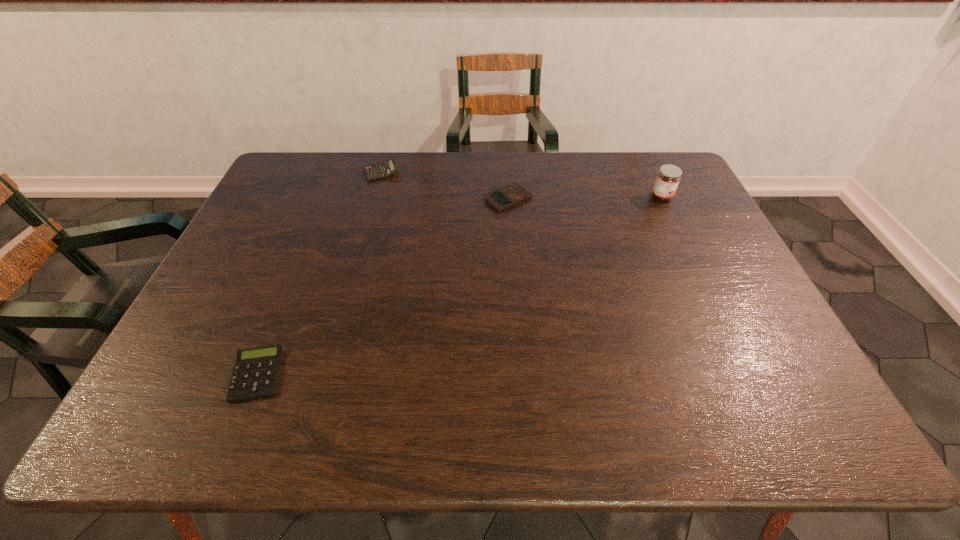
Identify the location of vacant space at the right edge of the desktop. This screenshot has width=960, height=540. (737, 294).

Where is `vacant space at the far left corner`? This screenshot has width=960, height=540. vacant space at the far left corner is located at coordinates (319, 180).

Locate an element on the screen. The image size is (960, 540). free space between the rightmost object and the leftmost object is located at coordinates click(x=460, y=286).

What are the coordinates of `blank region between the rightmost object and the second nearest calculator` in the screenshot? It's located at (586, 198).

I want to click on free space between the farthest object and the shortest calculator, so click(319, 273).

Locate an element on the screen. This screenshot has height=540, width=960. vacant area that lies between the rightmost object and the tallest calculator is located at coordinates (521, 185).

Where is `free space between the second shortest object and the second object from left to right`? free space between the second shortest object and the second object from left to right is located at coordinates (444, 185).

Locate an element on the screen. The image size is (960, 540). vacant space in between the tallest calculator and the leftmost calculator is located at coordinates (319, 273).

Find the location of a particular element. vacant area that lies between the second object from right to left and the leftmost calculator is located at coordinates (383, 287).

At what (x,y) coordinates should I click in order to perform the action: click on free space between the second object from left to right and the third tallest object. Please return your answer as a coordinate pair (x, y). Looking at the image, I should click on (444, 185).